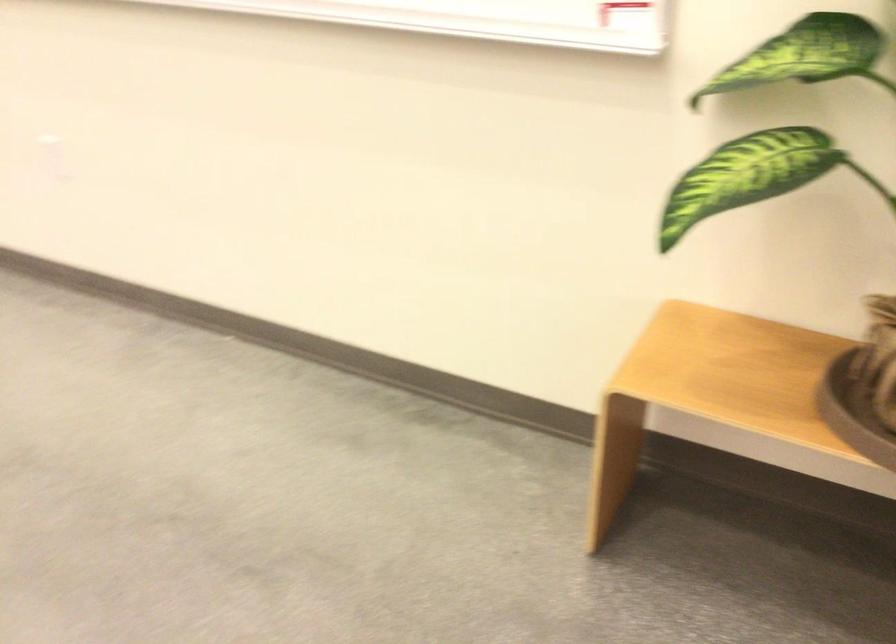
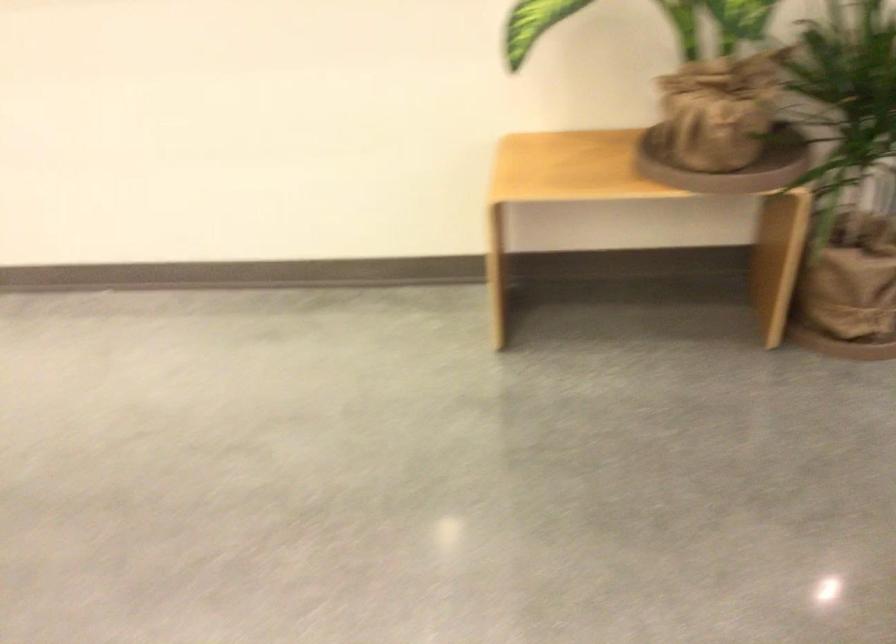
In a continuous first-person perspective shot, in which direction is the camera moving?

The movement direction of the cameraman is left, backward.